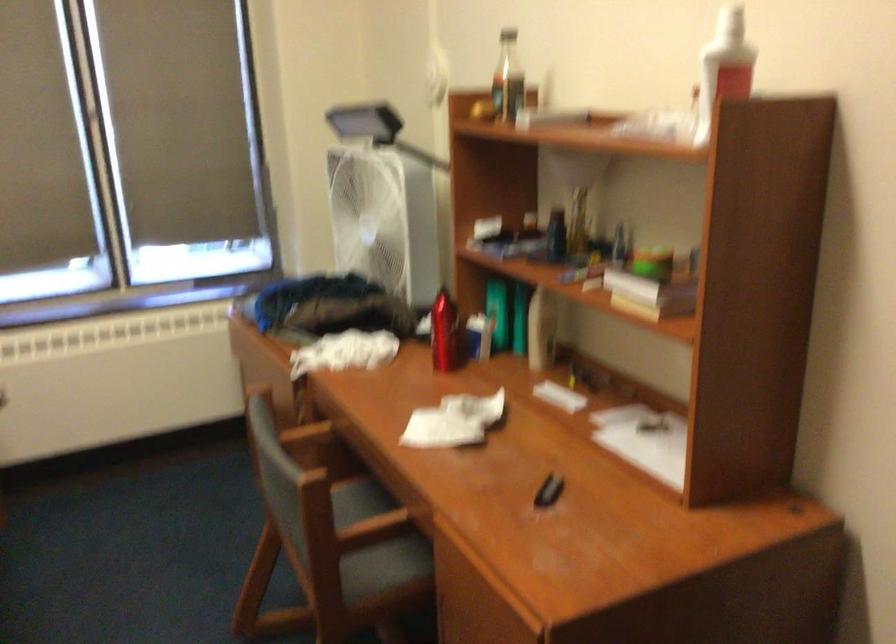
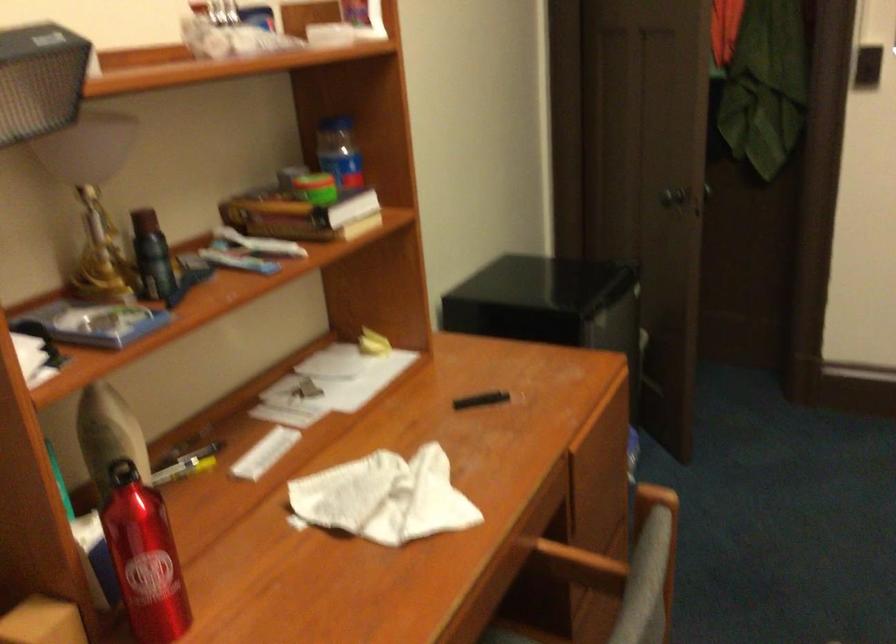
Find the pixel in the second image that matches (x=555, y=496) in the first image.

(480, 400)